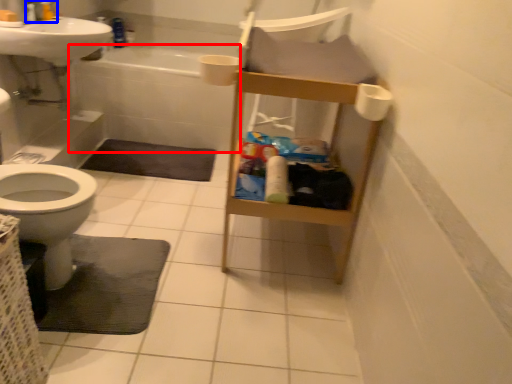
Question: Among these objects, which one is farthest to the camera, bath (highlighted by a red box) or plumbing fixture (highlighted by a blue box)?

Choices:
 (A) bath
 (B) plumbing fixture

Answer: (A)